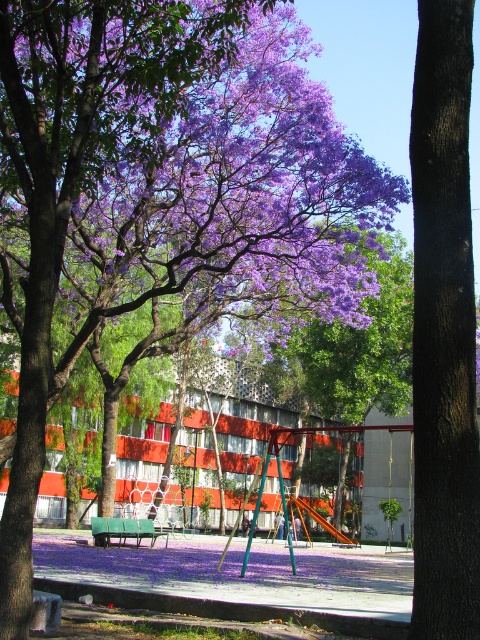
Question: Considering the real-world distances, which object is closest to the purple matte flower at upper center?

Choices:
 (A) green plastic bench at center
 (B) purple matte tree at center
 (C) brown rough bark tree at center

Answer: (A)

Question: Does purple matte flower at upper center appear on the left side of green plastic bench at center?

Choices:
 (A) no
 (B) yes

Answer: (A)

Question: Estimate the real-world distances between objects in this image. Which object is farther from the purple matte tree at center?

Choices:
 (A) green plastic bench at center
 (B) purple matte flower at upper center
 (C) brown rough bark tree at center

Answer: (C)

Question: Which point is farther to the camera?

Choices:
 (A) (158, 22)
 (B) (375, 264)

Answer: (B)

Question: Does brown rough bark tree at center have a smaller size compared to purple matte tree at center?

Choices:
 (A) no
 (B) yes

Answer: (B)

Question: Is brown rough bark tree at center above green plastic bench at center?

Choices:
 (A) yes
 (B) no

Answer: (A)